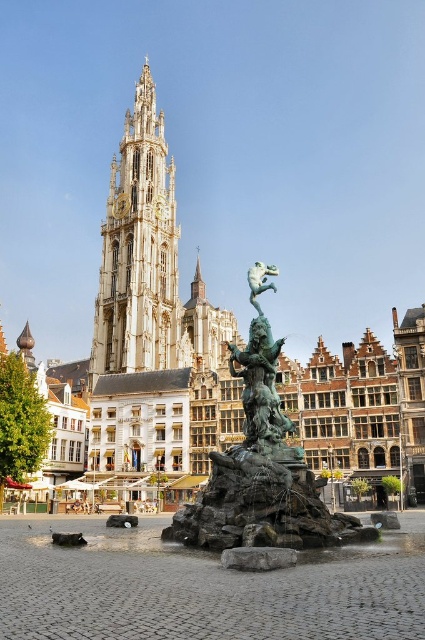
Question: Does bronze statue at center appear under white stone tower at center?

Choices:
 (A) no
 (B) yes

Answer: (B)

Question: Is bronze statue at center smaller than white stone tower at center?

Choices:
 (A) no
 (B) yes

Answer: (B)

Question: Is the position of bronze statue at center less distant than that of white stone tower at center?

Choices:
 (A) yes
 (B) no

Answer: (A)

Question: Which point is farther to the camera?

Choices:
 (A) white stone tower at center
 (B) bronze statue at center

Answer: (A)

Question: Which point is closer to the camera taking this photo?

Choices:
 (A) (201, 544)
 (B) (130, 326)

Answer: (A)